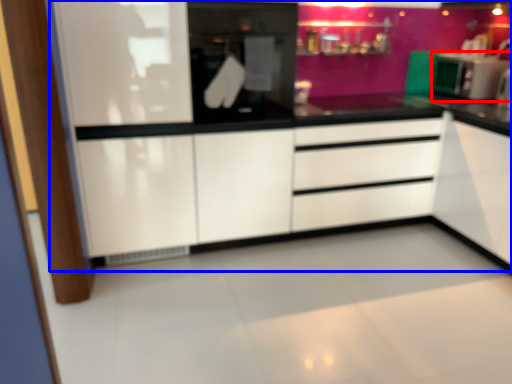
Question: Among these objects, which one is farthest to the camera, kitchen appliance (highlighted by a red box) or dresser (highlighted by a blue box)?

Choices:
 (A) kitchen appliance
 (B) dresser

Answer: (A)